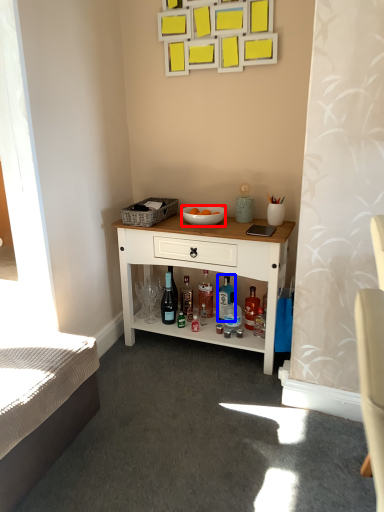
Question: Which object is closer to the camera taking this photo, bowl (highlighted by a red box) or bottle (highlighted by a blue box)?

Choices:
 (A) bowl
 (B) bottle

Answer: (A)